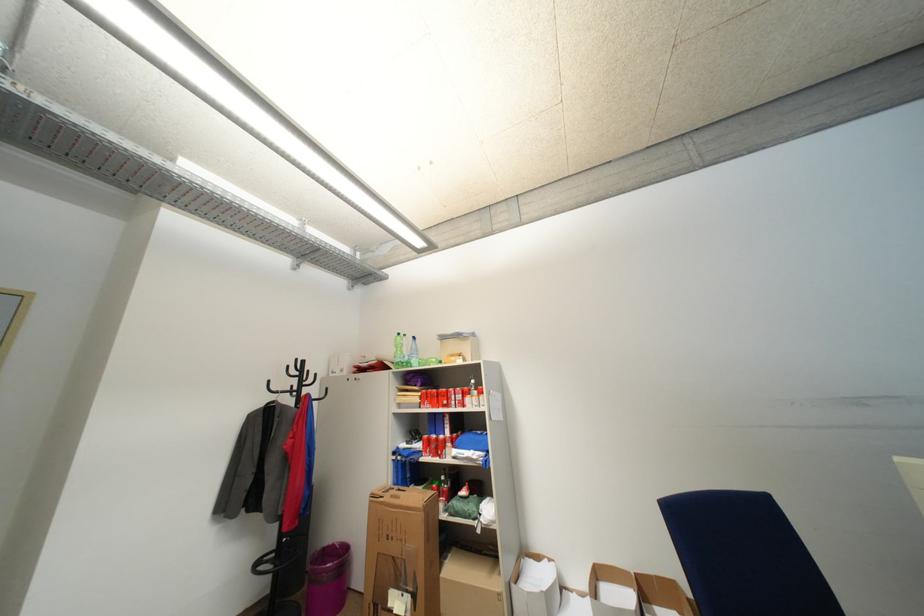
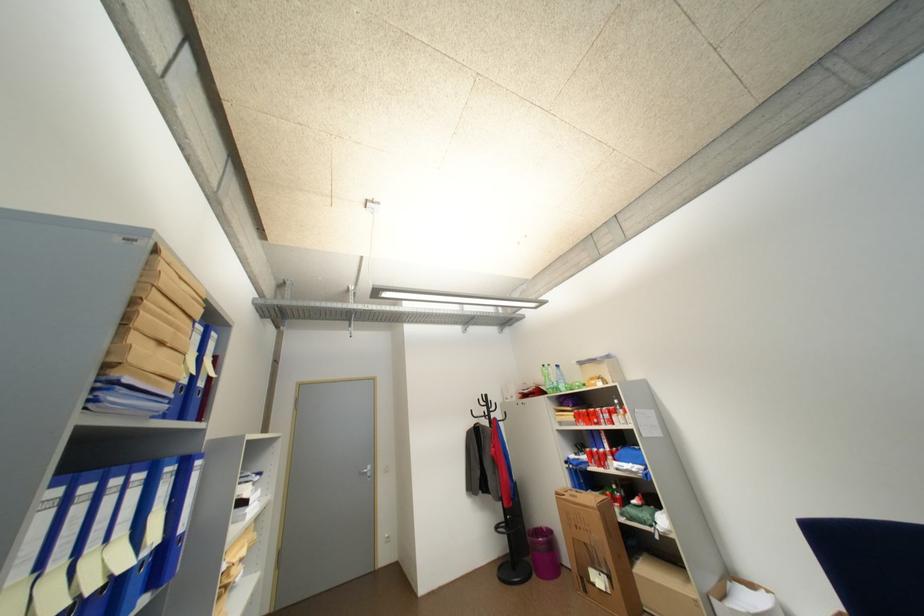
Question: The camera is either moving clockwise (left) or counter-clockwise (right) around the object. The first image is from the beginning of the video and the second image is from the end. Is the camera moving left or right when shooting the video?

Choices:
 (A) Left
 (B) Right

Answer: (B)